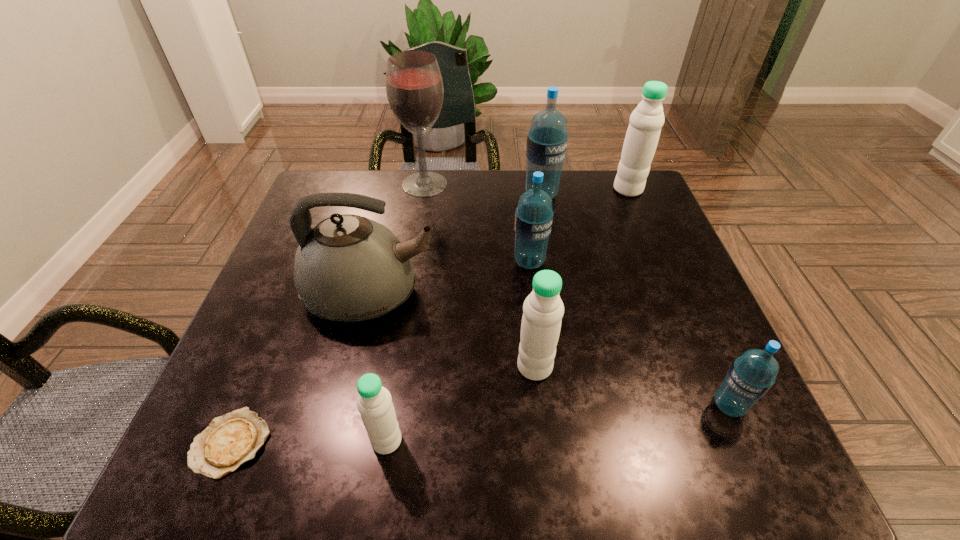
Locate an element on the screen. The width and height of the screenshot is (960, 540). white water bottle identified as the second closest to the second biggest white water bottle is located at coordinates (642, 136).

Identify which white water bottle is the third nearest to the red alcohol. Please provide its 2D coordinates. Your answer should be formatted as a tuple, i.e. [(x, y)], where the tuple contains the x and y coordinates of a point satisfying the conditions above.

[(374, 403)]

Select which blue water bottle appears as the second closest to the nearest blue water bottle. Please provide its 2D coordinates. Your answer should be formatted as a tuple, i.e. [(x, y)], where the tuple contains the x and y coordinates of a point satisfying the conditions above.

[(547, 139)]

Locate an element on the screen. The image size is (960, 540). blue water bottle that is the third closest to the gray kettle is located at coordinates (751, 375).